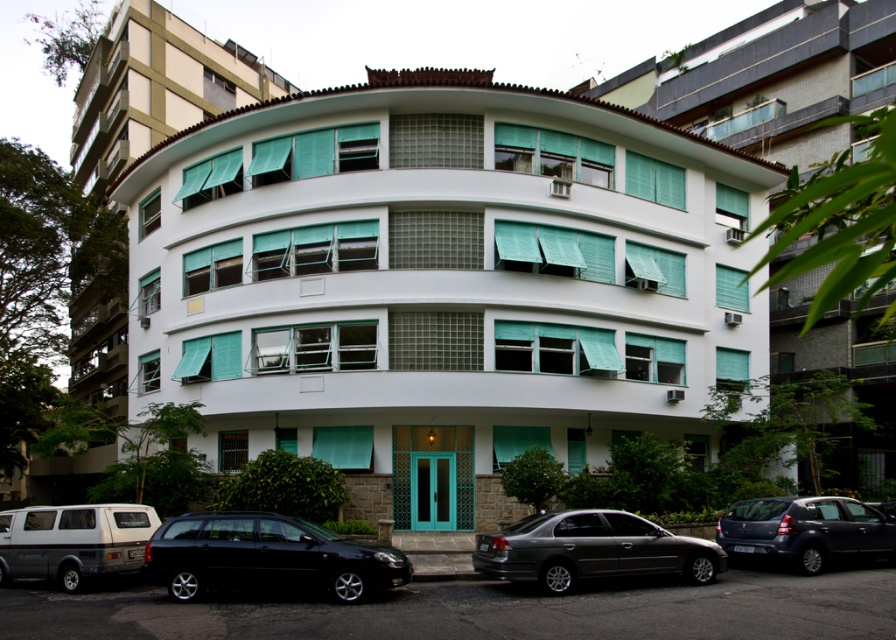
You are driving a delivery van that is 3 meters long and need to park between the black matte station wagon at lower left and the metallic gray sedan at center. Is there enough space between them to park your van?

The distance between the black matte station wagon at lower left and the metallic gray sedan at center is 3.22 meters. Since your van is 3 meters long, there is enough space to park between them as the distance is slightly longer than the van.

You are driving a delivery van that is 2 meters wide. You need to park between the black matte station wagon at lower left and the metallic gray sedan at center. Can your van fit in the space between them?

The black matte station wagon at lower left is thinner than the metallic gray sedan at center. However, the exact width of the space between them isn